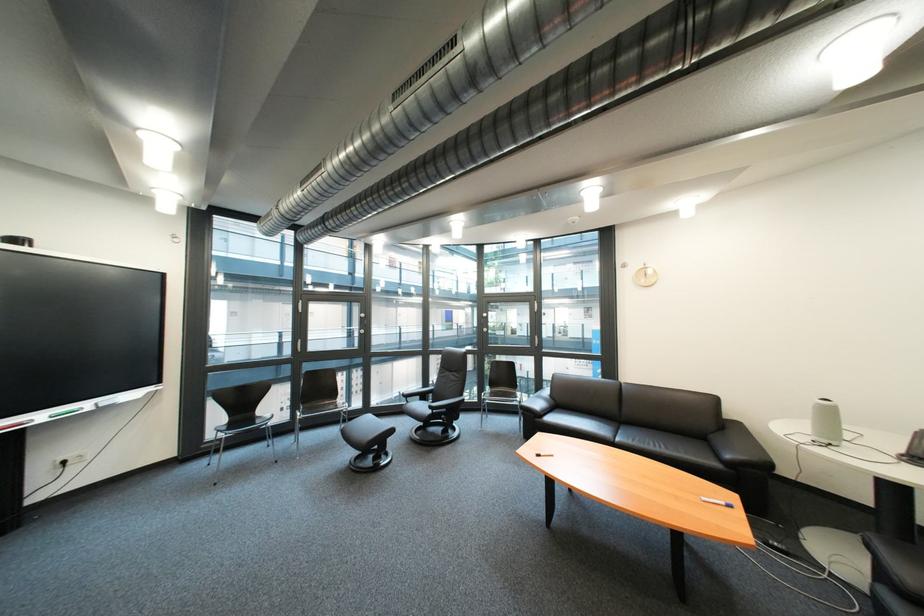
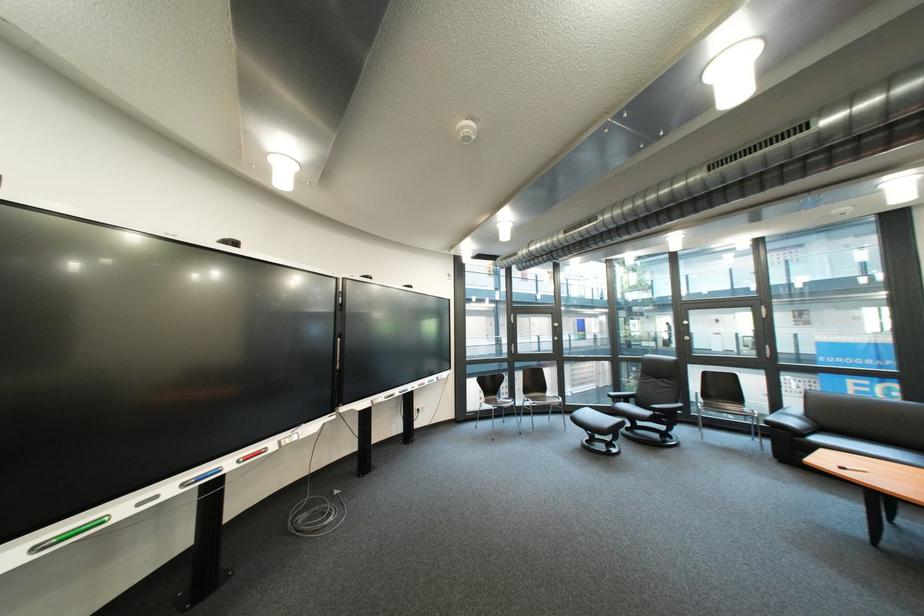
The point at (551, 406) is marked in the first image. Where is the corresponding point in the second image?

(806, 423)